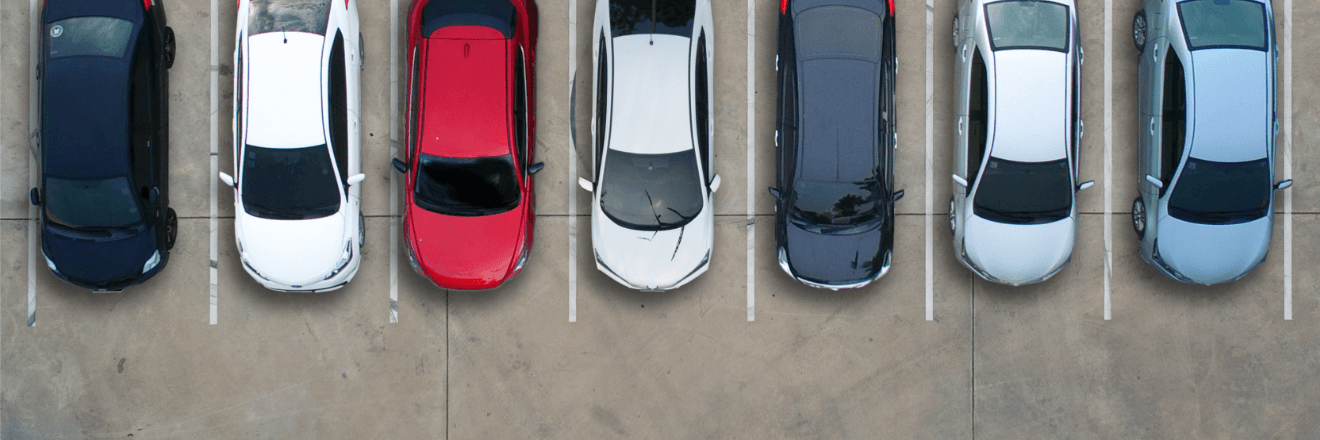
The width and height of the screenshot is (1320, 440). I want to click on hood, so click(x=462, y=253), click(x=86, y=263), click(x=297, y=256), click(x=645, y=262), click(x=845, y=255), click(x=1005, y=256), click(x=1203, y=245).